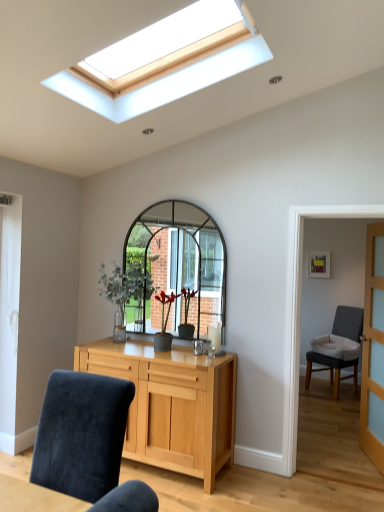
The image size is (384, 512). Describe the element at coordinates (330, 369) in the screenshot. I see `gray fabric chair at right, positioned as the 1th chair in back-to-front order` at that location.

Identify the location of matte gray vase at center. (168, 306).

Image resolution: width=384 pixels, height=512 pixels. I want to click on clear glass door at right, so click(x=373, y=350).

The height and width of the screenshot is (512, 384). What are the coordinates of `green glass vase at center` in the screenshot? It's located at (124, 292).

Image resolution: width=384 pixels, height=512 pixels. Find the location of `the 1st chair below the matte gray vase at center (from the image's perspective)`. the 1st chair below the matte gray vase at center (from the image's perspective) is located at coordinates (87, 442).

From the image's perspective, is matte gray vase at center below velvet blue chair at lower left, the 1th chair viewed from the front?

No, from the image's perspective, matte gray vase at center is not beneath velvet blue chair at lower left, the 1th chair viewed from the front.

Considering the sizes of objects matte gray vase at center and velvet blue chair at lower left, marked as the second chair in a back-to-front arrangement, in the image provided, who is wider, matte gray vase at center or velvet blue chair at lower left, marked as the second chair in a back-to-front arrangement,?

With larger width is velvet blue chair at lower left, marked as the second chair in a back-to-front arrangement.

Considering the sizes of objects matte gray vase at center and velvet blue chair at lower left, the 1th chair when ordered from left to right, in the image provided, who is smaller, matte gray vase at center or velvet blue chair at lower left, the 1th chair when ordered from left to right,?

matte gray vase at center is smaller.

From the image's perspective, which one is positioned lower, gray fabric chair at right, the 2th chair positioned from the front, or green glass vase at center?

gray fabric chair at right, the 2th chair positioned from the front, appears lower in the image.

In terms of height, does gray fabric chair at right, which ranks as the second chair in left-to-right order, look taller or shorter compared to green glass vase at center?

gray fabric chair at right, which ranks as the second chair in left-to-right order, is taller than green glass vase at center.

Is gray fabric chair at right, the 2th chair positioned from the front, oriented towards green glass vase at center?

Yes, gray fabric chair at right, the 2th chair positioned from the front, is oriented towards green glass vase at center.

Is gray fabric chair at right, the 2th chair positioned from the front, beside green glass vase at center?

No, gray fabric chair at right, the 2th chair positioned from the front, is not making contact with green glass vase at center.

Which object is closer to the camera, gray fabric chair at right, the 2th chair positioned from the front, or light wood cabinet at center?

light wood cabinet at center.

Can you confirm if gray fabric chair at right, positioned as the 1th chair in back-to-front order, is shorter than light wood cabinet at center?

In fact, gray fabric chair at right, positioned as the 1th chair in back-to-front order, may be taller than light wood cabinet at center.

Considering the positions of objects gray fabric chair at right, the 1th chair viewed from the right, and light wood cabinet at center in the image provided, who is more to the right, gray fabric chair at right, the 1th chair viewed from the right, or light wood cabinet at center?

Positioned to the right is gray fabric chair at right, the 1th chair viewed from the right.

Is gray fabric chair at right, which ranks as the second chair in left-to-right order, with light wood cabinet at center?

gray fabric chair at right, which ranks as the second chair in left-to-right order, is not next to light wood cabinet at center, and they're not touching.

Is light wood cabinet at center next to gray fabric chair at right, which ranks as the second chair in left-to-right order?

light wood cabinet at center is not next to gray fabric chair at right, which ranks as the second chair in left-to-right order, and they're not touching.

Considering the positions of objects light wood cabinet at center and gray fabric chair at right, which ranks as the second chair in left-to-right order, in the image provided, who is behind, light wood cabinet at center or gray fabric chair at right, which ranks as the second chair in left-to-right order,?

gray fabric chair at right, which ranks as the second chair in left-to-right order.

Can you confirm if light wood cabinet at center is positioned to the right of gray fabric chair at right, positioned as the 1th chair in back-to-front order?

No.

Image resolution: width=384 pixels, height=512 pixels. Find the location of `chair that is behind the light wood cabinet at center`. chair that is behind the light wood cabinet at center is located at coordinates (330, 369).

Is light wood cabinet at center at the left side of clear glass door at right?

Correct, you'll find light wood cabinet at center to the left of clear glass door at right.

Is point (150, 409) in front of point (379, 468)?

Yes, point (150, 409) is closer to viewer.

Does light wood cabinet at center have a greater height compared to clear glass door at right?

Incorrect, the height of light wood cabinet at center is not larger of that of clear glass door at right.

From the image's perspective, is light wood cabinet at center positioned above or below clear glass door at right?

light wood cabinet at center is situated lower than clear glass door at right in the image.

Who is taller, velvet blue chair at lower left, the 1th chair viewed from the front, or matte gray vase at center?

velvet blue chair at lower left, the 1th chair viewed from the front, is taller.

Is the surface of velvet blue chair at lower left, the 1th chair when ordered from left to right, in direct contact with matte gray vase at center?

No, velvet blue chair at lower left, the 1th chair when ordered from left to right, is not beside matte gray vase at center.

In the scene shown: Between velvet blue chair at lower left, marked as the second chair in a back-to-front arrangement, and matte gray vase at center, which one has smaller width?

matte gray vase at center is thinner.

Find the location of `chair behind the clear glass door at right`. chair behind the clear glass door at right is located at coordinates (330, 369).

Is point (369, 429) closer or farther from the camera than point (320, 362)?

Point (369, 429) is positioned closer to the camera compared to point (320, 362).

From the image's perspective, does clear glass door at right appear lower than gray fabric chair at right, the 2th chair positioned from the front?

Incorrect, from the image's perspective, clear glass door at right is higher than gray fabric chair at right, the 2th chair positioned from the front.

Which is correct: clear glass door at right is inside gray fabric chair at right, the 1th chair viewed from the right, or outside of it?

The correct answer is: outside.

Find the location of a particular element. This screenshot has width=384, height=512. flower that is above the velvet blue chair at lower left, the second chair positioned from the right (from the image's perspective) is located at coordinates (168, 306).

The image size is (384, 512). Find the location of `houseplant lying in front of the gray fabric chair at right, which ranks as the second chair in left-to-right order`. houseplant lying in front of the gray fabric chair at right, which ranks as the second chair in left-to-right order is located at coordinates (124, 292).

Looking at the image, which one is located closer to clear glass door at right, light wood cabinet at center or velvet blue chair at lower left, the 1th chair viewed from the front?

Based on the image, light wood cabinet at center appears to be nearer to clear glass door at right.

Based on their spatial positions, is green glass vase at center or gray fabric chair at right, which ranks as the second chair in left-to-right order, closer to matte gray vase at center?

green glass vase at center is positioned closer to the anchor matte gray vase at center.

Considering their positions, is matte gray vase at center positioned further to clear glass door at right than velvet blue chair at lower left, the 1th chair when ordered from left to right?

The object further to clear glass door at right is velvet blue chair at lower left, the 1th chair when ordered from left to right.

Based on their spatial positions, is light wood cabinet at center or gray fabric chair at right, the 1th chair viewed from the right, closer to green glass vase at center?

Among the two, light wood cabinet at center is located nearer to green glass vase at center.

Based on their spatial positions, is gray fabric chair at right, the 1th chair viewed from the right, or matte gray vase at center closer to green glass vase at center?

matte gray vase at center.

In the scene shown: When comparing their distances from light wood cabinet at center, does clear glass door at right or green glass vase at center seem closer?

green glass vase at center lies closer to light wood cabinet at center than the other object.

Based on their spatial positions, is gray fabric chair at right, the 1th chair viewed from the right, or light wood cabinet at center further from green glass vase at center?

gray fabric chair at right, the 1th chair viewed from the right, is further to green glass vase at center.

Looking at the image, which one is located closer to matte gray vase at center, gray fabric chair at right, positioned as the 1th chair in back-to-front order, or green glass vase at center?

The object closer to matte gray vase at center is green glass vase at center.

Locate an element on the screen. The width and height of the screenshot is (384, 512). the chest of drawers situated between green glass vase at center and gray fabric chair at right, the 1th chair viewed from the right, from left to right is located at coordinates (172, 404).

In order to click on flower between velvet blue chair at lower left, the 1th chair when ordered from left to right, and gray fabric chair at right, which ranks as the second chair in left-to-right order, along the z-axis in this screenshot , I will do `click(168, 306)`.

Locate an element on the screen. This screenshot has height=512, width=384. chest of drawers between velvet blue chair at lower left, the 1th chair viewed from the front, and green glass vase at center, along the z-axis is located at coordinates (172, 404).

Locate an element on the screen. The height and width of the screenshot is (512, 384). flower located between green glass vase at center and clear glass door at right in the left-right direction is located at coordinates pyautogui.click(x=168, y=306).